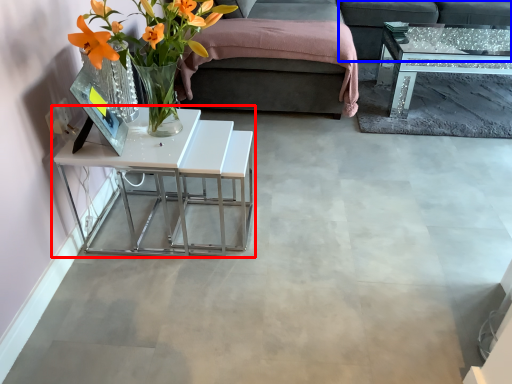
Question: Which point is closer to the camera, table (highlighted by a red box) or couch (highlighted by a blue box)?

Choices:
 (A) table
 (B) couch

Answer: (A)